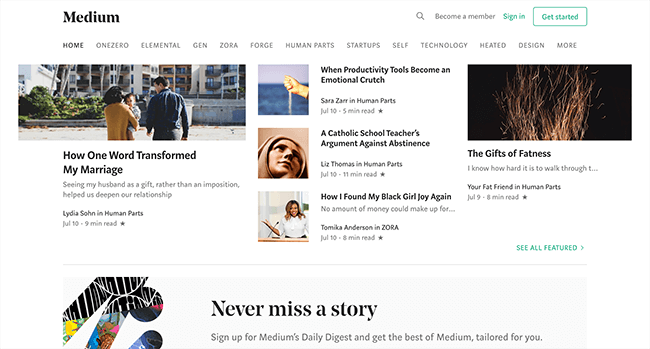
Find the location of `statue`. statue is located at coordinates (287, 152).